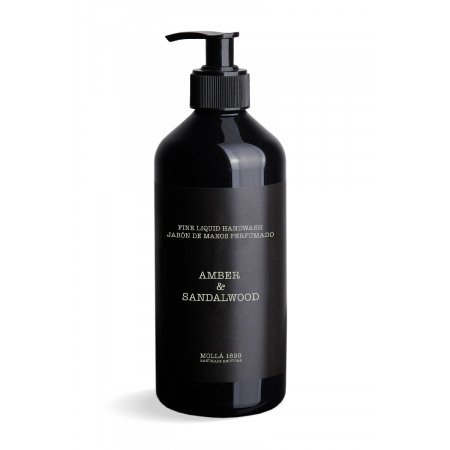
Where is `bottle`? bottle is located at coordinates point(226,163).